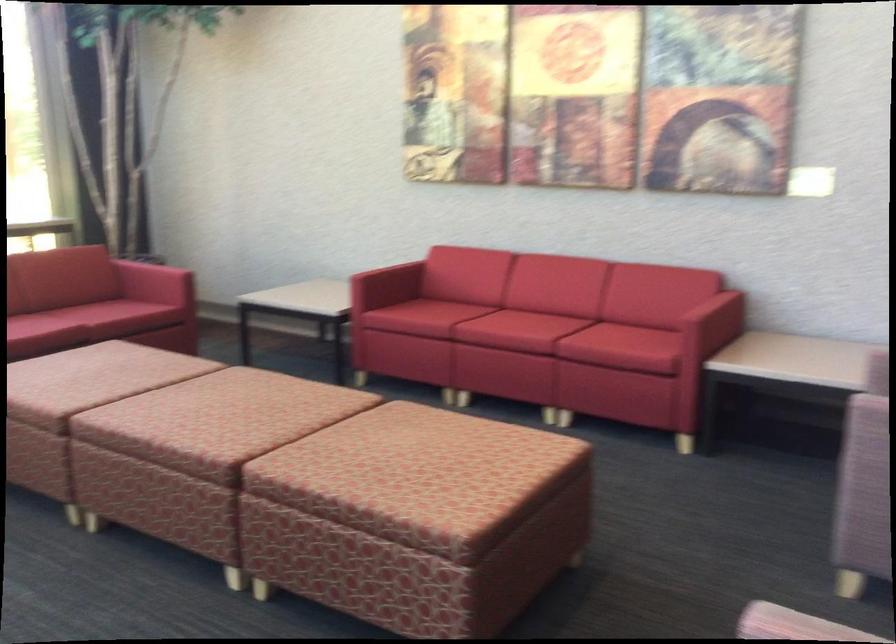
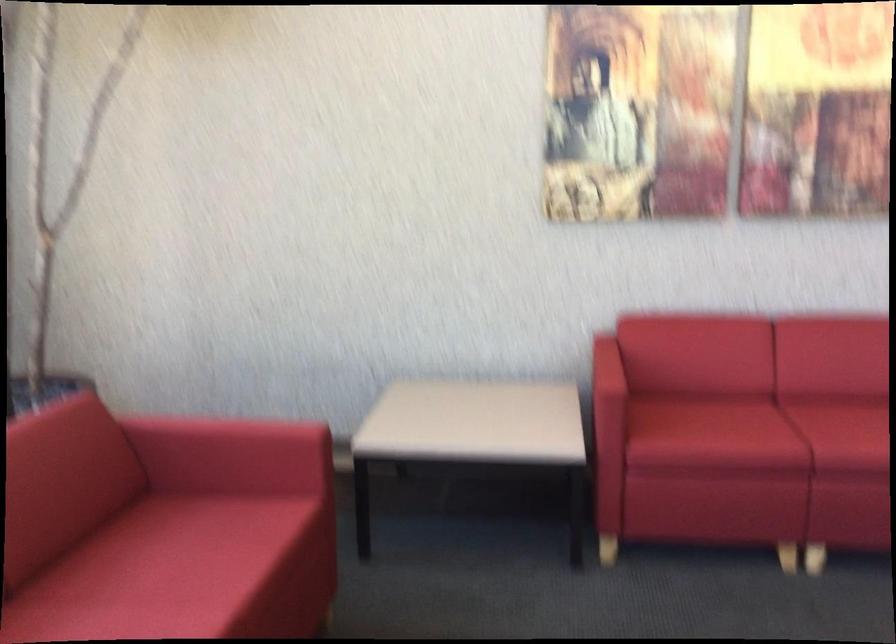
Find the pixel in the second image that matches (438,308) in the first image.

(757, 431)